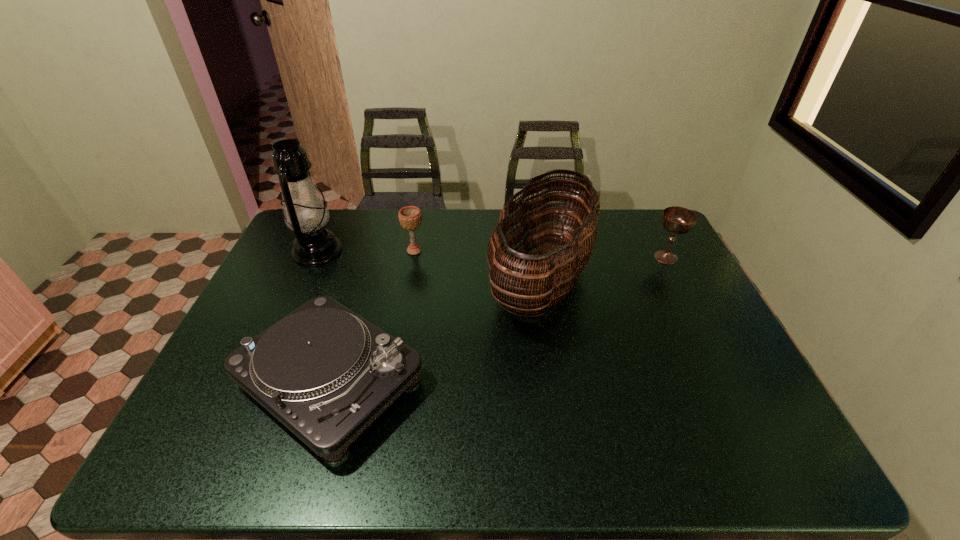
Image resolution: width=960 pixels, height=540 pixels. In the image, there is a desktop. In order to click on vacant space at the far edge in this screenshot , I will do `click(444, 219)`.

You are a GUI agent. You are given a task and a screenshot of the screen. Output one action in this format:
    pyautogui.click(x=<x>, y=<y>)
    Task: Click on the vacant space at the left edge
    The width and height of the screenshot is (960, 540).
    Given the screenshot: What is the action you would take?
    pyautogui.click(x=260, y=414)

This screenshot has height=540, width=960. What are the coordinates of `vacant space at the right edge of the desktop` in the screenshot? It's located at (724, 407).

You are a GUI agent. You are given a task and a screenshot of the screen. Output one action in this format:
    pyautogui.click(x=<x>, y=<y>)
    Task: Click on the vacant space at the far left corner of the desktop
    Image resolution: width=960 pixels, height=540 pixels.
    Given the screenshot: What is the action you would take?
    pyautogui.click(x=339, y=210)

Locate an element on the screen. The width and height of the screenshot is (960, 540). vacant space at the near left corner of the desktop is located at coordinates (240, 459).

Identify the location of vacant point at the far right corner. The width and height of the screenshot is (960, 540). (630, 245).

The image size is (960, 540). What are the coordinates of `vacant point located between the right chalice and the second object from right to left` in the screenshot? It's located at (604, 268).

Find the location of a particular element. Image resolution: width=960 pixels, height=540 pixels. unoccupied position between the right chalice and the second object from right to left is located at coordinates point(604,268).

You are a GUI agent. You are given a task and a screenshot of the screen. Output one action in this format:
    pyautogui.click(x=<x>, y=<y>)
    Task: Click on the free point between the second object from right to left and the left chalice
    The width and height of the screenshot is (960, 540).
    Given the screenshot: What is the action you would take?
    pyautogui.click(x=478, y=265)

This screenshot has height=540, width=960. I want to click on free spot between the left chalice and the oil lamp, so click(366, 251).